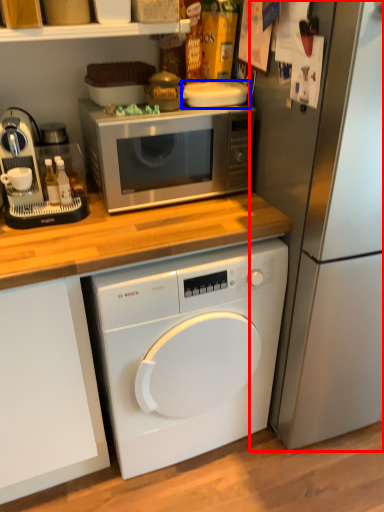
Question: Which object appears closest to the camera in this image, refrigerator (highlighted by a red box) or appliance (highlighted by a blue box)?

Choices:
 (A) refrigerator
 (B) appliance

Answer: (A)